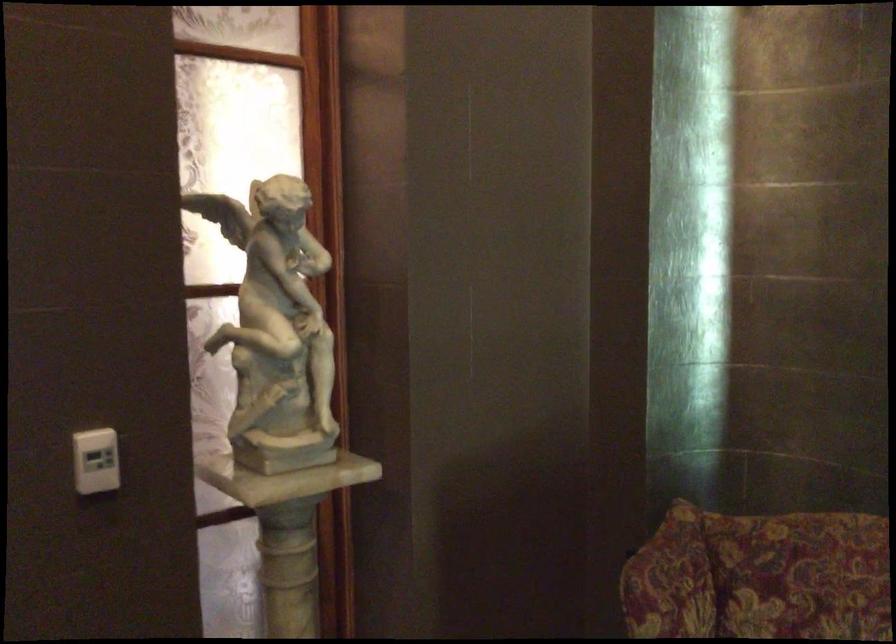
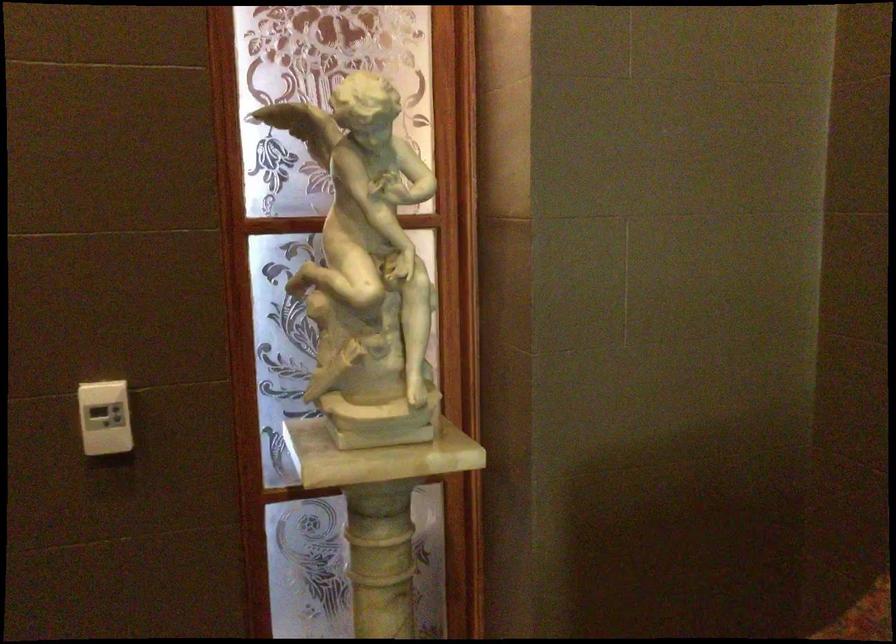
Question: The images are taken continuously from a first-person perspective. In which direction is your viewpoint rotating?

Choices:
 (A) Left
 (B) Right
 (C) Up
 (D) Down

Answer: (A)